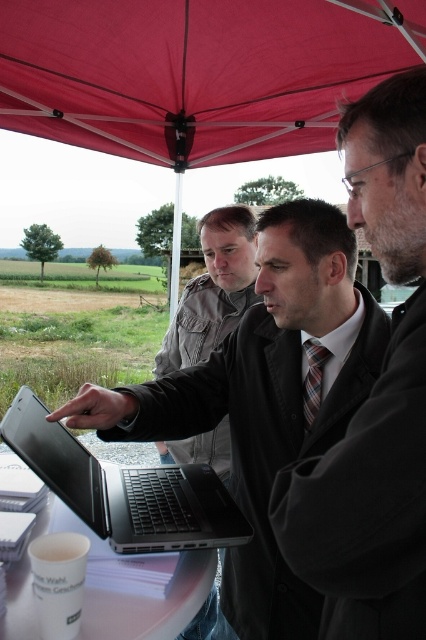
Question: Considering the relative positions of dark gray suit at center and plaid fabric tie at center in the image provided, where is dark gray suit at center located with respect to plaid fabric tie at center?

Choices:
 (A) below
 (B) above

Answer: (B)

Question: Can you confirm if red fabric umbrella at upper center is positioned below dark gray suit at center?

Choices:
 (A) no
 (B) yes

Answer: (A)

Question: Which point is farther to the camera?

Choices:
 (A) black matte laptop at center
 (B) matte black laptop at center

Answer: (B)

Question: Is matte black laptop at center above dark gray jacket at center?

Choices:
 (A) no
 (B) yes

Answer: (A)

Question: Which object is the closest to the matte black laptop at center?

Choices:
 (A) plaid fabric tie at center
 (B) dark gray suit at center

Answer: (A)

Question: Among these objects, which one is farthest from the camera?

Choices:
 (A) black matte laptop at center
 (B) matte black laptop at center
 (C) white plastic round table at center

Answer: (B)